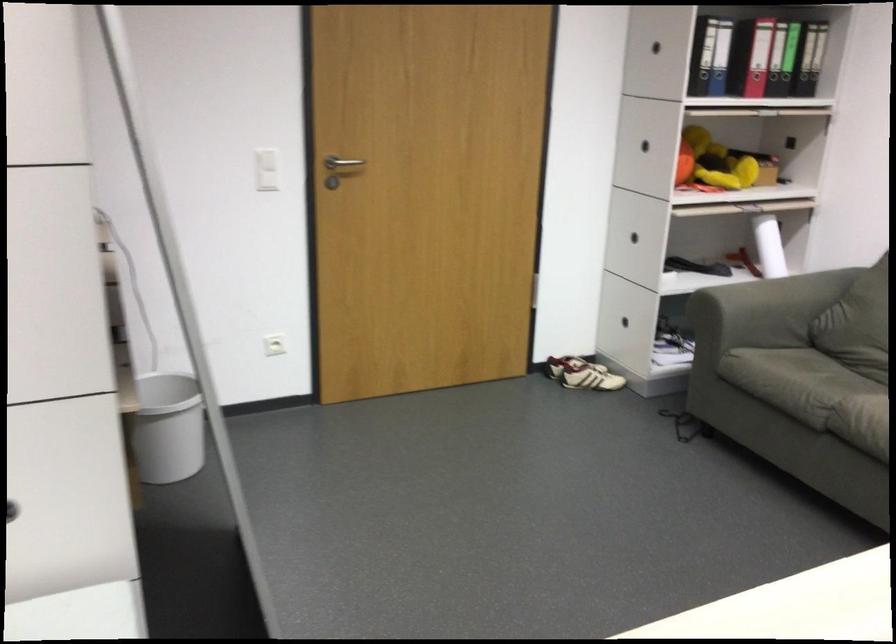
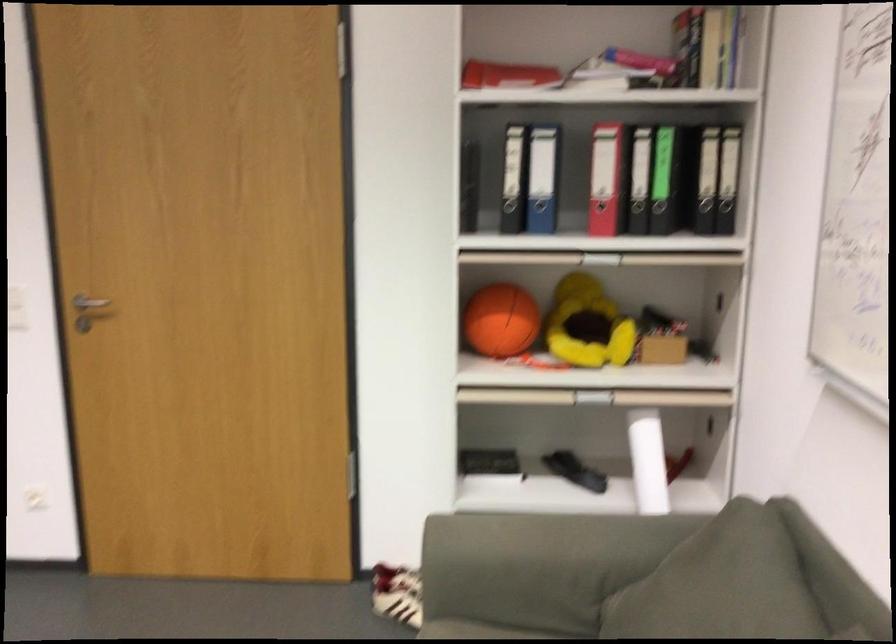
The point at (x=708, y=70) is marked in the first image. Where is the corresponding point in the second image?

(539, 216)